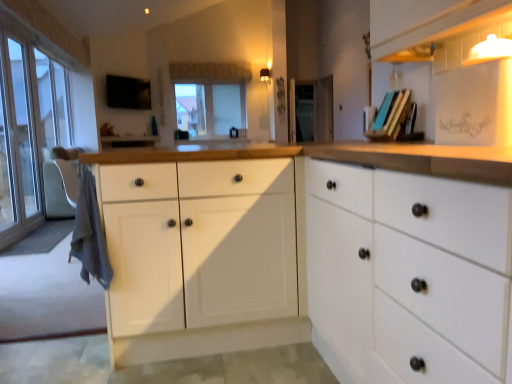
Question: Is matte white shelf at upper right spatially inside transparent glass screen door at center, or outside of it?

Choices:
 (A) outside
 (B) inside

Answer: (A)

Question: From their relative heights in the image, would you say matte white shelf at upper right is taller or shorter than transparent glass screen door at center?

Choices:
 (A) short
 (B) tall

Answer: (A)

Question: Which object is the closest to the transparent glass door at left?

Choices:
 (A) metallic black knob at center, which is the first knob in top-to-bottom order
 (B) metallic knob at center, the 2th knob ordered from the bottom
 (C) transparent glass window at center
 (D) transparent glass screen door at center
 (E) matte black knob at center, which is the 1th knob from bottom to top

Answer: (C)

Question: Which object is positioned farthest from the matte white shelf at upper right?

Choices:
 (A) metallic black knob at center, which is the third knob from bottom to top
 (B) metallic knob at center, which is the second knob from top to bottom
 (C) transparent glass window at center
 (D) matte blue book at upper right
 (E) matte black knob at center, which is counted as the third knob, starting from the top

Answer: (C)